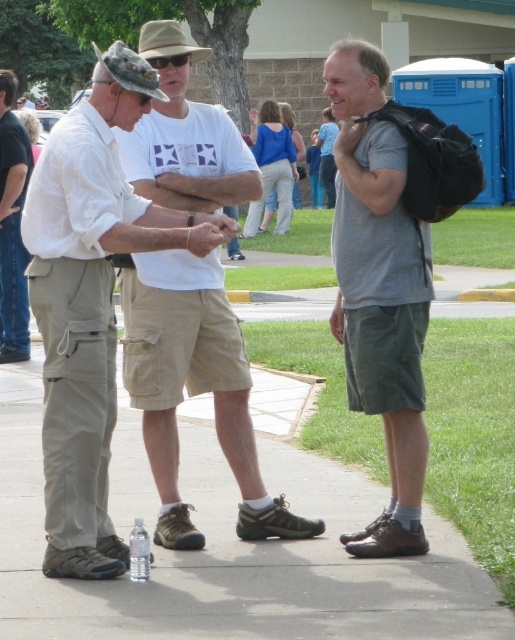
Between khaki cotton shorts at center and clear plastic bottle at center, which one appears on the right side from the viewer's perspective?

From the viewer's perspective, khaki cotton shorts at center appears more on the right side.

Can you confirm if khaki cotton shorts at center is positioned below clear plastic bottle at center?

No, khaki cotton shorts at center is not below clear plastic bottle at center.

Who is more distant from viewer, (132, 403) or (142, 552)?

The point (132, 403) is more distant.

This screenshot has height=640, width=515. I want to click on khaki cotton shorts at center, so click(x=194, y=388).

Is point (99, 547) in front of point (20, 268)?

Yes, it is.

Is khaki cargo pants at center bigger than matte khaki pants at center?

Indeed, khaki cargo pants at center has a larger size compared to matte khaki pants at center.

Does point (73, 259) come in front of point (12, 307)?

Yes, it is in front of point (12, 307).

This screenshot has width=515, height=640. Find the location of `khaki cargo pants at center`. khaki cargo pants at center is located at coordinates (91, 300).

Can you confirm if gray matte t-shirt at right is positioned to the right of clear plastic bottle at center?

Indeed, gray matte t-shirt at right is positioned on the right side of clear plastic bottle at center.

What do you see at coordinates (379, 291) in the screenshot? This screenshot has width=515, height=640. I see `gray matte t-shirt at right` at bounding box center [379, 291].

What are the coordinates of `gray matte t-shirt at right` in the screenshot? It's located at 379,291.